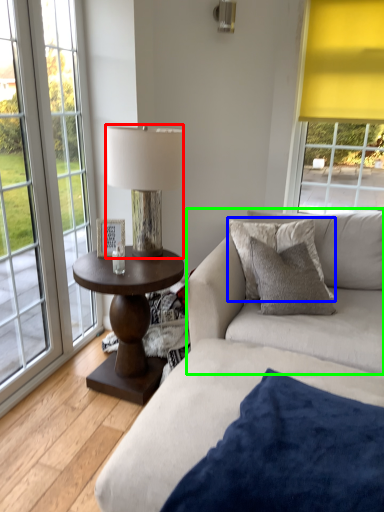
Question: Considering the real-world distances, which object is farthest from lamp (highlighted by a red box)? pillow (highlighted by a blue box) or couch (highlighted by a green box)?

Choices:
 (A) pillow
 (B) couch

Answer: (B)